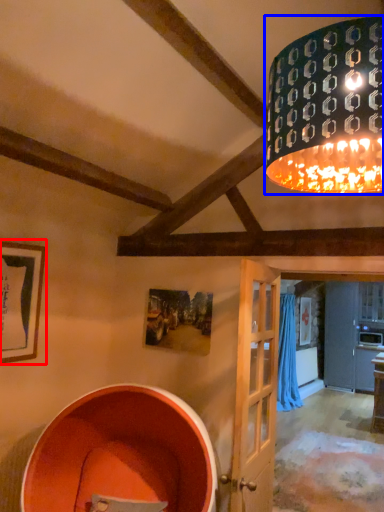
Question: Which of the following is the closest to the observer, picture frame (highlighted by a red box) or lamp (highlighted by a blue box)?

Choices:
 (A) picture frame
 (B) lamp

Answer: (B)